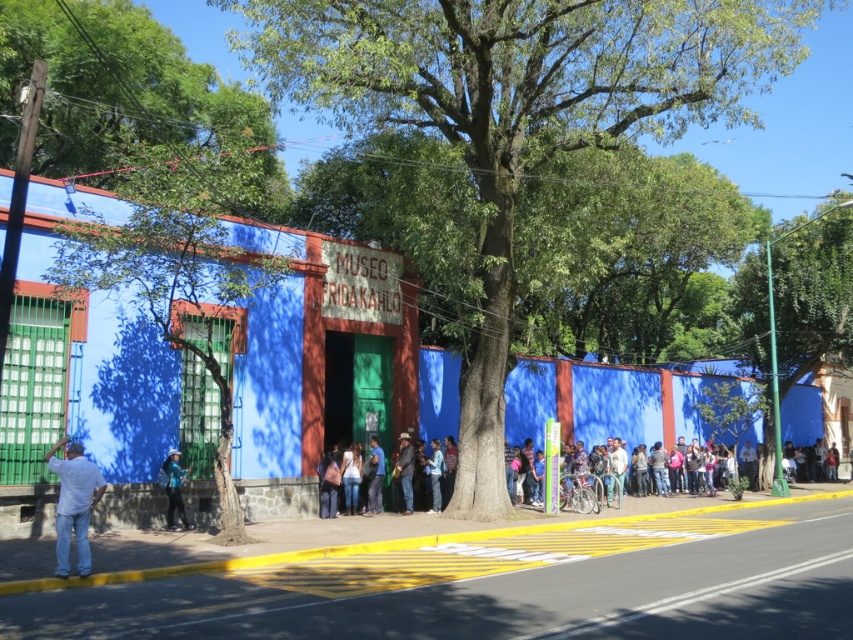
Who is positioned more to the left, green leafy tree at center or leather jacket at center?

leather jacket at center is more to the left.

What do you see at coordinates (517, 113) in the screenshot? I see `green leafy tree at center` at bounding box center [517, 113].

This screenshot has height=640, width=853. In order to click on green leafy tree at center in this screenshot , I will do `click(517, 113)`.

Who is higher up, leather jacket at center or light blue denim jeans at center?

leather jacket at center

Measure the distance between leather jacket at center and camera.

They are 19.02 meters apart.

Where is `leather jacket at center`? leather jacket at center is located at coordinates (405, 470).

Does white cotton shirt at lower left come in front of blue jeans at center?

Yes, it is in front of blue jeans at center.

Can you confirm if white cotton shirt at lower left is shorter than blue jeans at center?

No.

This screenshot has width=853, height=640. What do you see at coordinates (73, 502) in the screenshot?
I see `white cotton shirt at lower left` at bounding box center [73, 502].

The width and height of the screenshot is (853, 640). I want to click on white cotton shirt at lower left, so click(x=73, y=502).